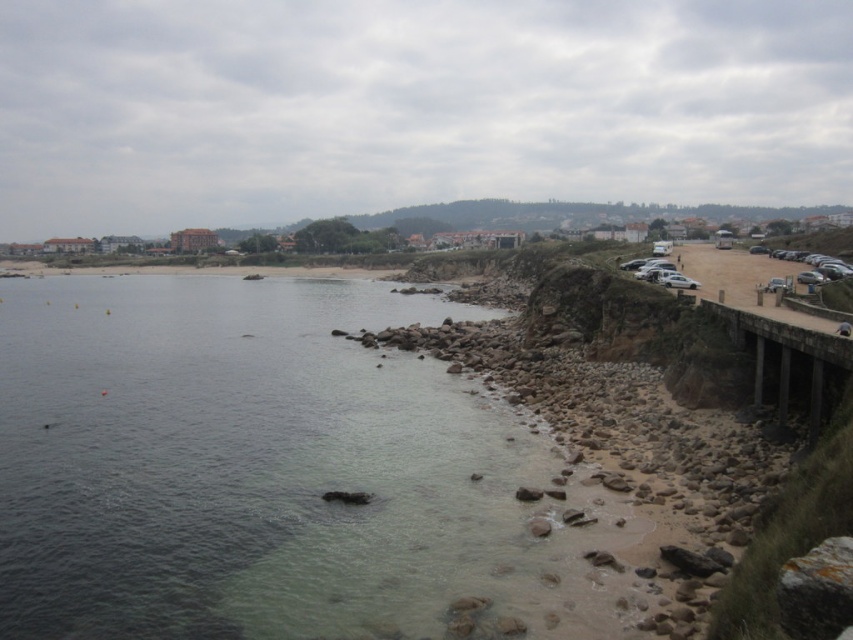
Is clear water at lower left behind concrete bridge at right?

No, clear water at lower left is in front of concrete bridge at right.

Does clear water at lower left come in front of concrete bridge at right?

Yes, clear water at lower left is closer to the viewer.

Between point (383, 541) and point (813, 388), which one is positioned in front?

Point (383, 541) is more forward.

The width and height of the screenshot is (853, 640). In order to click on clear water at lower left in this screenshot , I will do `click(252, 467)`.